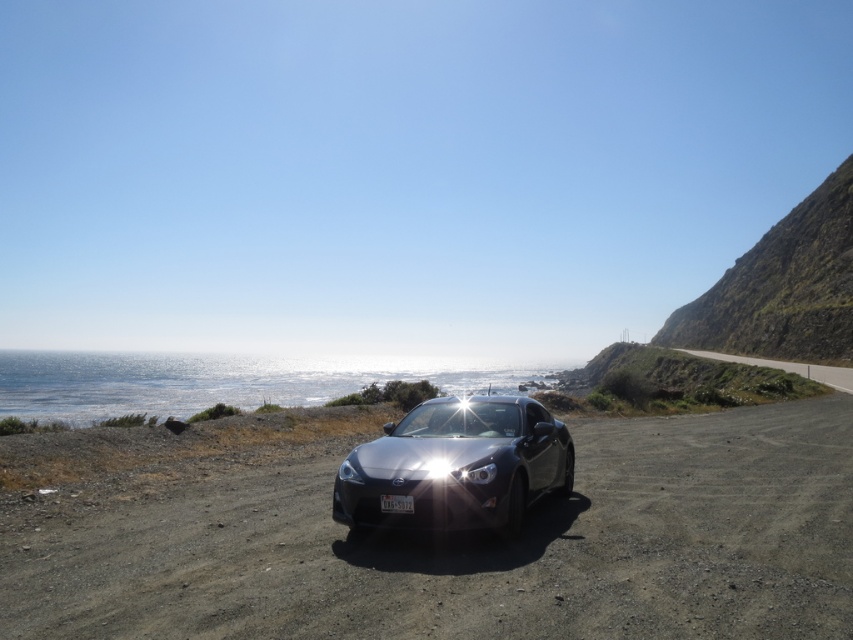
You are standing at the camera position and want to walk to the point located at coordinates point (526, 595) and point (450, 472). Which point will you reach first?

You will reach point (526, 595) first because it is closer to the camera than point (450, 472).

You are a photographer trying to capture the entire scene of the satin silver car at center and the matte silver headlight at center in one shot. Which object should you position closer to the left side of your camera frame to ensure both are fully visible?

The satin silver car at center is positioned on the right side of matte silver headlight at center. To capture both in one shot, you should position the matte silver headlight at center closer to the left side of your camera frame so that the satin silver car at center naturally falls on the right side, ensuring both are fully visible.

You are a photographer trying to capture the entire scene of the satin silver car at center and the matte silver headlight at center in one shot. Considering their heights, which object will appear larger in the photo?

The satin silver car at center is much taller than the matte silver headlight at center, so it will appear larger in the photo.